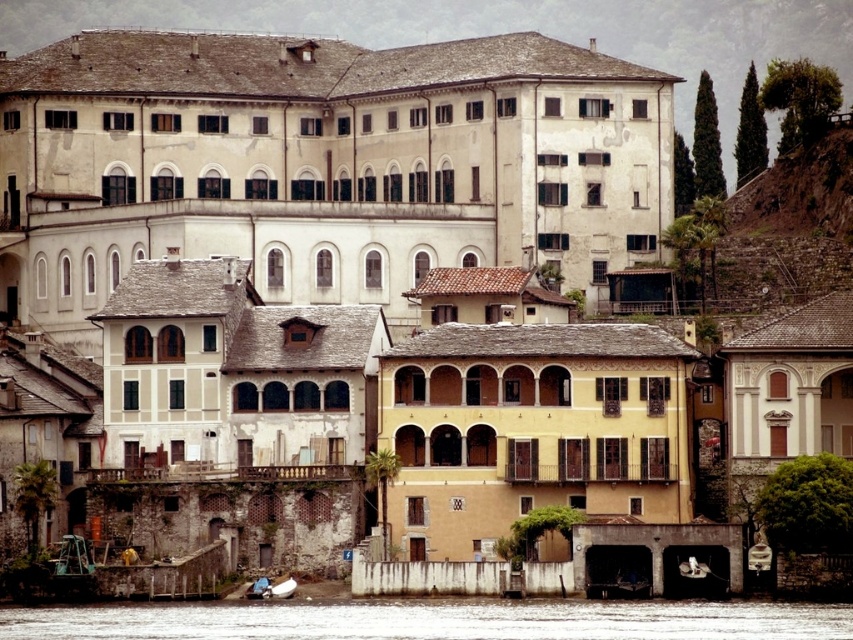
Does clear water at lower center come behind white glossy boat at lower center?

No, it is not.

Who is more distant from viewer, (x=271, y=632) or (x=283, y=596)?

The point (x=283, y=596) is more distant.

Does point (341, 612) come behind point (291, 586)?

No, (341, 612) is in front of (291, 586).

Where is `clear water at lower center`? This screenshot has height=640, width=853. clear water at lower center is located at coordinates (434, 620).

Which is behind, point (834, 260) or point (293, 579)?

Positioned behind is point (834, 260).

Consider the image. Who is lower down, brown rocky hillside at upper right or white glossy boat at lower center?

Positioned lower is white glossy boat at lower center.

Between point (799, 160) and point (271, 596), which one is positioned behind?

The point (799, 160) is more distant.

Where is `brown rocky hillside at upper right`? This screenshot has height=640, width=853. brown rocky hillside at upper right is located at coordinates [788, 228].

Does clear water at lower center appear over brown rocky hillside at upper right?

Incorrect, clear water at lower center is not positioned above brown rocky hillside at upper right.

Which is more to the right, clear water at lower center or brown rocky hillside at upper right?

brown rocky hillside at upper right

Is point (80, 620) farther from camera compared to point (828, 166)?

No, (80, 620) is closer to viewer.

What are the coordinates of `clear water at lower center` in the screenshot? It's located at (434, 620).